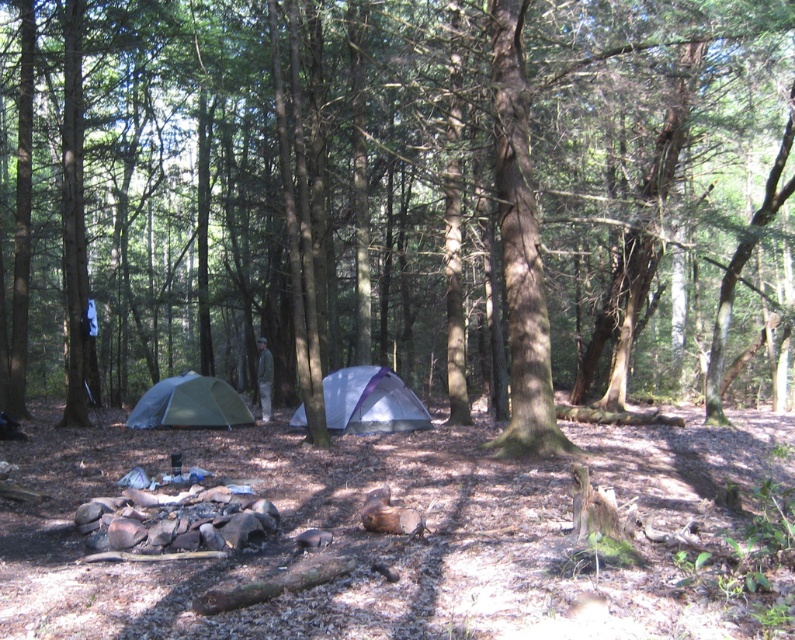
You are standing at the edge of the forest and want to walk towards the point marked as point (400, 198). According to the scene description, what will you encounter at that point?

The point (400, 198) is located on the brown rough tree at center, so you will encounter the brown rough tree at center there.

You are planning to set up a picnic table between the silver metallic tent at center and the green fabric tent at center. The picnic table requires a space of 3 meters between the two tents. Will there be enough space?

The silver metallic tent at center is 3.38 meters from the green fabric tent at center, so yes, there is enough space to place the picnic table between them as the distance is greater than the required 3 meters.

You are standing in the middle of the forest and want to walk towards the two points marked in the image. Which point, point [782,188] or point [394,413], will you reach first?

You will reach point [782,188] first because it is closer to you than point [394,413].